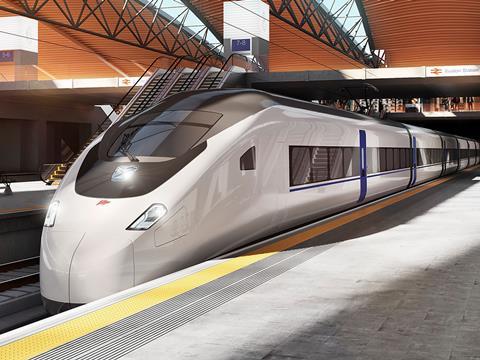
At what (x,y) coordinates should I click in order to perform the action: click on floor. Please return your answer as a coordinate pair (x, y). This screenshot has height=360, width=480. Looking at the image, I should click on (413, 292).